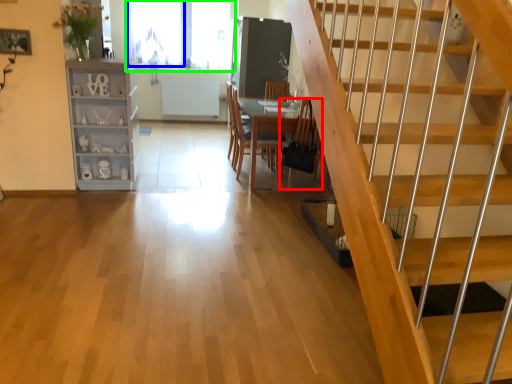
Question: Considering the real-world distances, which object is farthest from armchair (highlighted by a red box)? window (highlighted by a blue box) or window (highlighted by a green box)?

Choices:
 (A) window
 (B) window

Answer: (A)